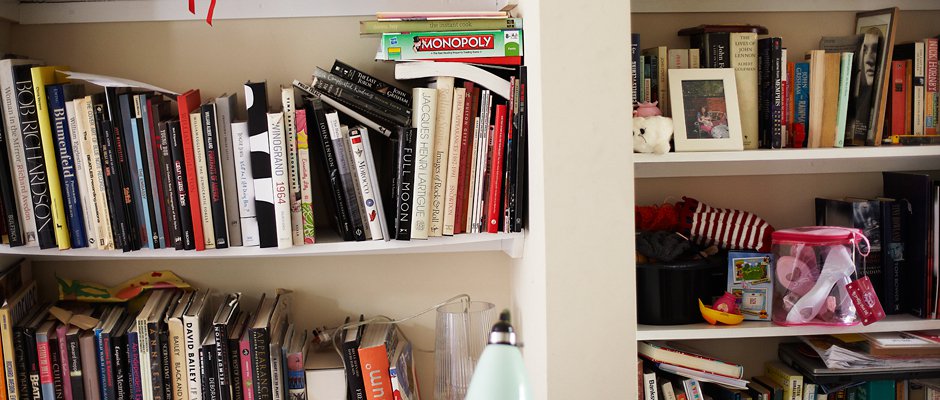
Where is `lamp light cover`? The height and width of the screenshot is (400, 940). lamp light cover is located at coordinates (508, 376).